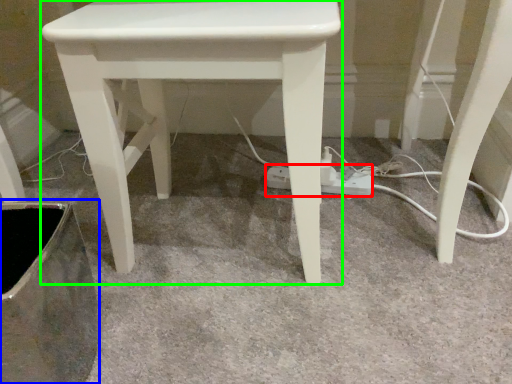
Question: Which object is the closest to the extension cord (highlighted by a red box)? Choose among these: swivel chair (highlighted by a blue box) or stool (highlighted by a green box).

Choices:
 (A) swivel chair
 (B) stool

Answer: (B)